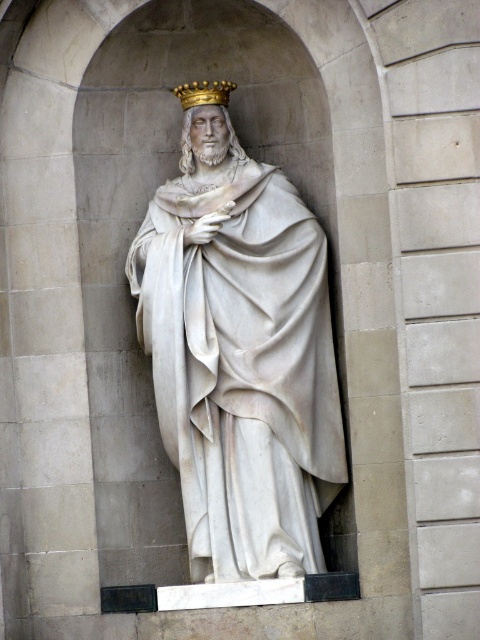
Who is taller, white marble statue at center or gold metallic crown at upper center?

white marble statue at center is taller.

The image size is (480, 640). What do you see at coordinates (240, 355) in the screenshot? I see `white marble statue at center` at bounding box center [240, 355].

Is point (143, 266) behind point (187, 99)?

No, it is not.

Locate an element on the screen. This screenshot has height=640, width=480. white marble statue at center is located at coordinates (240, 355).

Between golden crown at center and gold metallic crown at upper center, which one is positioned lower?

gold metallic crown at upper center is below.

How far apart are golden crown at center and gold metallic crown at upper center?

golden crown at center and gold metallic crown at upper center are 10.87 inches apart.

Find the location of a particular element. The width and height of the screenshot is (480, 640). golden crown at center is located at coordinates (202, 104).

Between white marble statue at center and golden crown at center, which one is positioned lower?

white marble statue at center is below.

Is white marble statue at center to the right of golden crown at center from the viewer's perspective?

Correct, you'll find white marble statue at center to the right of golden crown at center.

Find the location of a particular element. white marble statue at center is located at coordinates (240, 355).